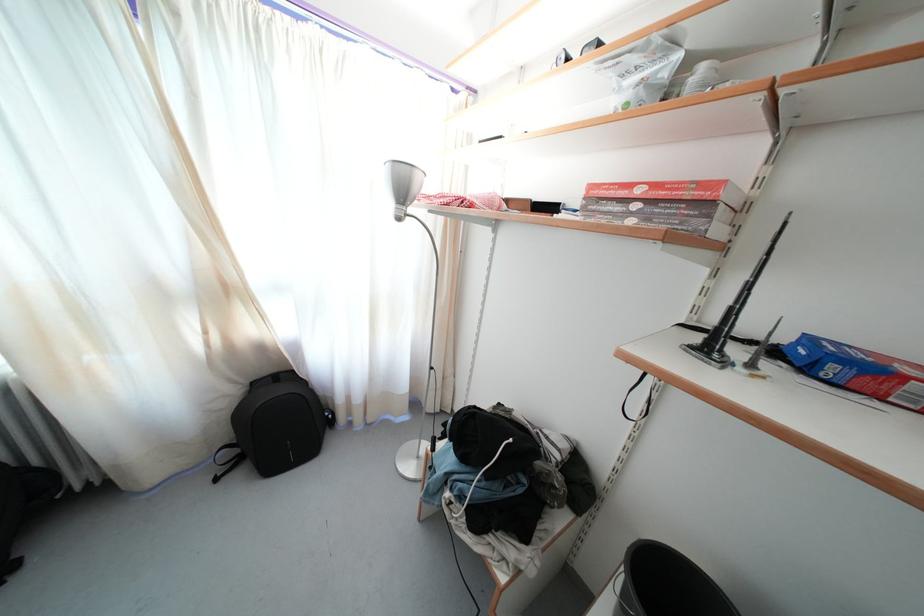
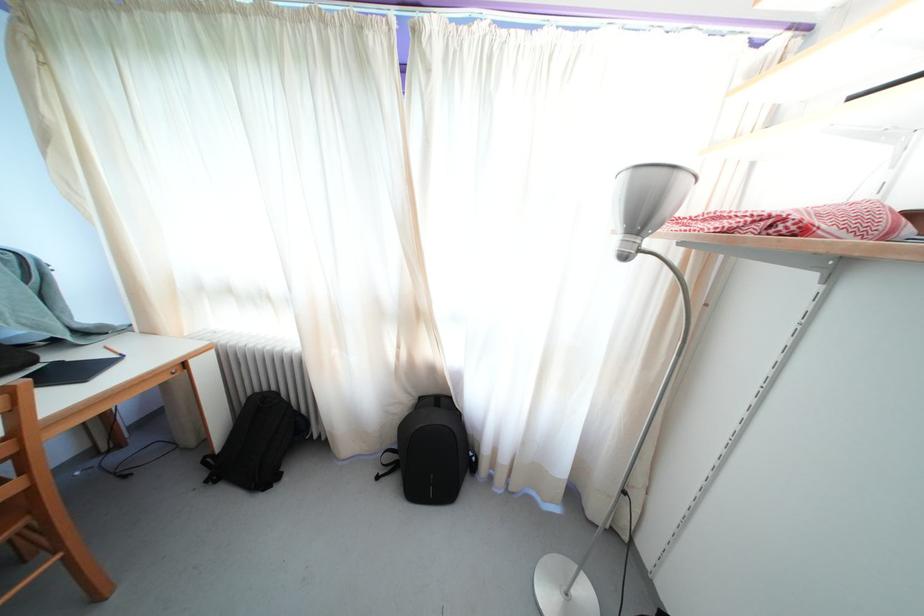
Where in the second image is the point corresponding to point (229, 297) from the first image?

(421, 321)